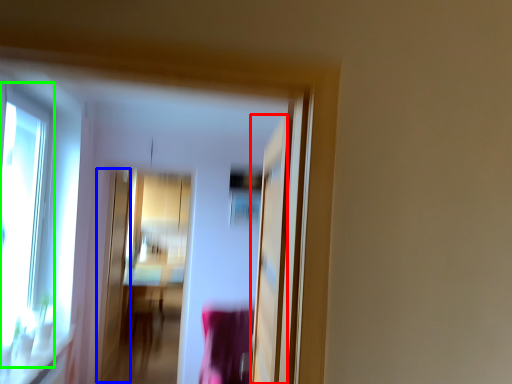
Question: Which object is the closest to the screen door (highlighted by a red box)? Choose among these: screen door (highlighted by a blue box) or window (highlighted by a green box).

Choices:
 (A) screen door
 (B) window

Answer: (B)